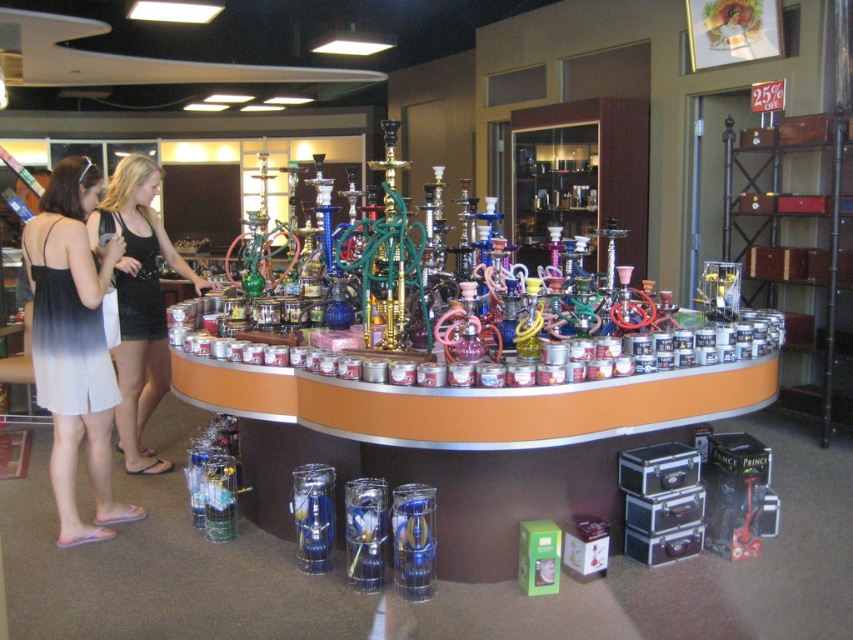
Who is more distant from viewer, (x=79, y=291) or (x=134, y=413)?

The point (x=134, y=413) is behind.

Who is positioned more to the left, white fabric dress at left or black dress at left?

black dress at left is more to the left.

What do you see at coordinates (74, 346) in the screenshot?
I see `white fabric dress at left` at bounding box center [74, 346].

Identify the location of white fabric dress at left. This screenshot has height=640, width=853. (74, 346).